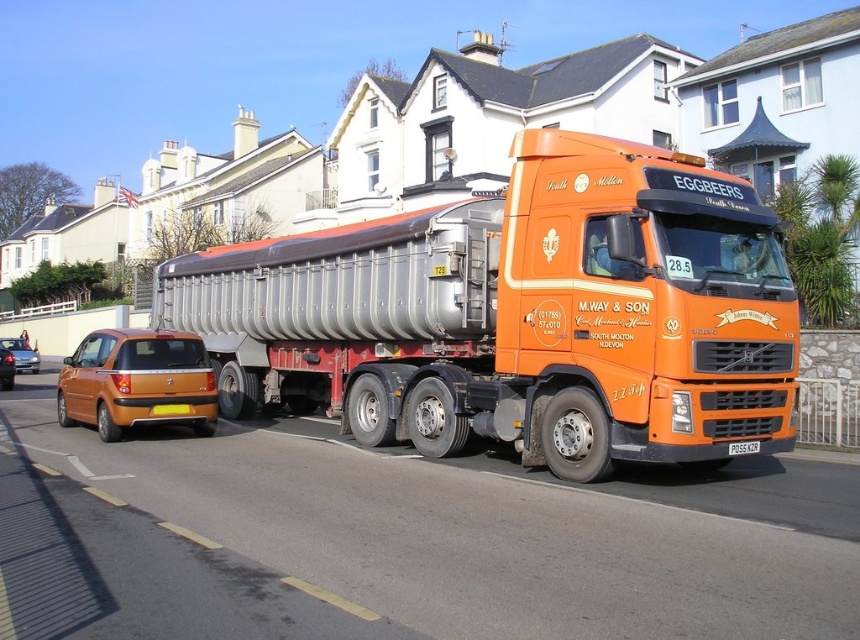
Question: Among these objects, which one is farthest from the camera?

Choices:
 (A) orange matte car at left
 (B) orange matte hatchback at left
 (C) metallic orange hatchback at left

Answer: (B)

Question: Does orange matte hatchback at left appear over whitemetalliclicense plate at right?

Choices:
 (A) yes
 (B) no

Answer: (A)

Question: Is metallic orange hatchback at left wider than whitemetalliclicense plate at right?

Choices:
 (A) no
 (B) yes

Answer: (B)

Question: Estimate the real-world distances between objects in this image. Which object is closer to the orange matte hatchback at left?

Choices:
 (A) metallic orange hatchback at left
 (B) orange matte truck at center

Answer: (A)

Question: Is orange matte hatchback at left thinner than orange matte car at left?

Choices:
 (A) yes
 (B) no

Answer: (B)

Question: Which point is farther from the camera taking this photo?

Choices:
 (A) (733, 451)
 (B) (25, 349)

Answer: (B)